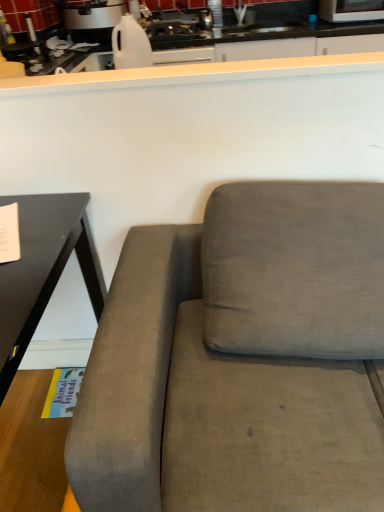
Question: From a real-world perspective, does white glossy rice cooker at upper left, marked as the 1th appliance in a left-to-right arrangement, sit lower than white smooth countertop at upper center?

Choices:
 (A) no
 (B) yes

Answer: (B)

Question: Does white glossy rice cooker at upper left, acting as the second appliance starting from the right, come in front of white smooth countertop at upper center?

Choices:
 (A) no
 (B) yes

Answer: (A)

Question: Is the depth of white glossy rice cooker at upper left, marked as the 1th appliance in a left-to-right arrangement, greater than that of white smooth countertop at upper center?

Choices:
 (A) no
 (B) yes

Answer: (B)

Question: Does white glossy rice cooker at upper left, acting as the second appliance starting from the right, have a smaller size compared to white smooth countertop at upper center?

Choices:
 (A) yes
 (B) no

Answer: (B)

Question: From the image's perspective, does white glossy rice cooker at upper left, acting as the second appliance starting from the right, appear lower than white smooth countertop at upper center?

Choices:
 (A) yes
 (B) no

Answer: (B)

Question: Is white glossy rice cooker at upper left, marked as the 1th appliance in a left-to-right arrangement, wider than white smooth countertop at upper center?

Choices:
 (A) no
 (B) yes

Answer: (B)

Question: Is metallic silver microwave at upper right, the 2th appliance in the left-to-right sequence, to the right of white glossy rice cooker at upper left, marked as the 1th appliance in a left-to-right arrangement, from the viewer's perspective?

Choices:
 (A) no
 (B) yes

Answer: (B)

Question: Considering the relative positions of metallic silver microwave at upper right, which is counted as the first appliance, starting from the right, and white glossy rice cooker at upper left, marked as the 1th appliance in a left-to-right arrangement, in the image provided, is metallic silver microwave at upper right, which is counted as the first appliance, starting from the right, behind white glossy rice cooker at upper left, marked as the 1th appliance in a left-to-right arrangement,?

Choices:
 (A) yes
 (B) no

Answer: (A)

Question: Is metallic silver microwave at upper right, which is counted as the first appliance, starting from the right, shorter than white glossy rice cooker at upper left, marked as the 1th appliance in a left-to-right arrangement?

Choices:
 (A) no
 (B) yes

Answer: (B)

Question: Is metallic silver microwave at upper right, which is counted as the first appliance, starting from the right, positioned in front of white glossy rice cooker at upper left, marked as the 1th appliance in a left-to-right arrangement?

Choices:
 (A) yes
 (B) no

Answer: (B)

Question: Is metallic silver microwave at upper right, the 2th appliance in the left-to-right sequence, touching white glossy rice cooker at upper left, acting as the second appliance starting from the right?

Choices:
 (A) yes
 (B) no

Answer: (B)

Question: Can you confirm if metallic silver microwave at upper right, which is counted as the first appliance, starting from the right, is smaller than white glossy rice cooker at upper left, marked as the 1th appliance in a left-to-right arrangement?

Choices:
 (A) yes
 (B) no

Answer: (A)

Question: From a real-world perspective, is white smooth countertop at upper center located higher than metallic silver microwave at upper right, which is counted as the first appliance, starting from the right?

Choices:
 (A) no
 (B) yes

Answer: (B)